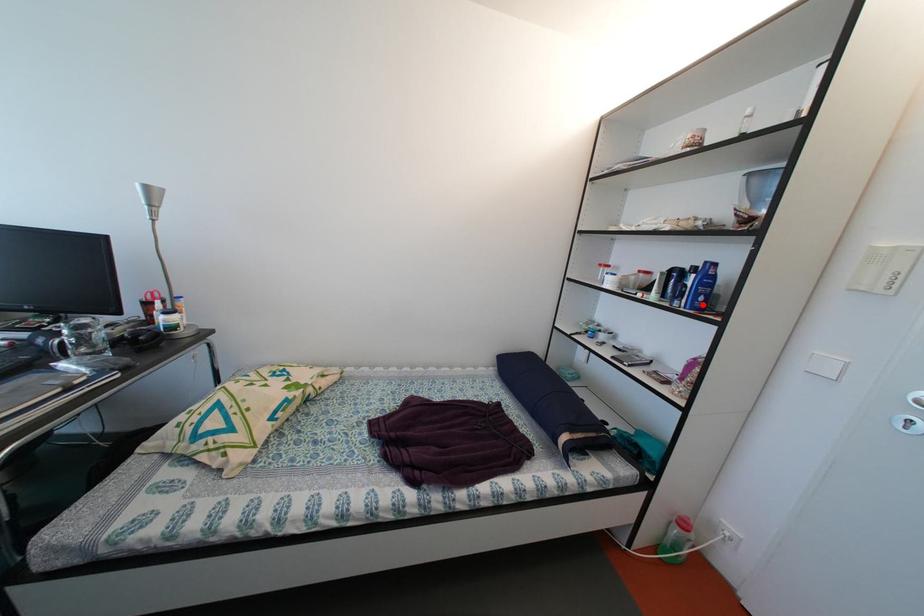
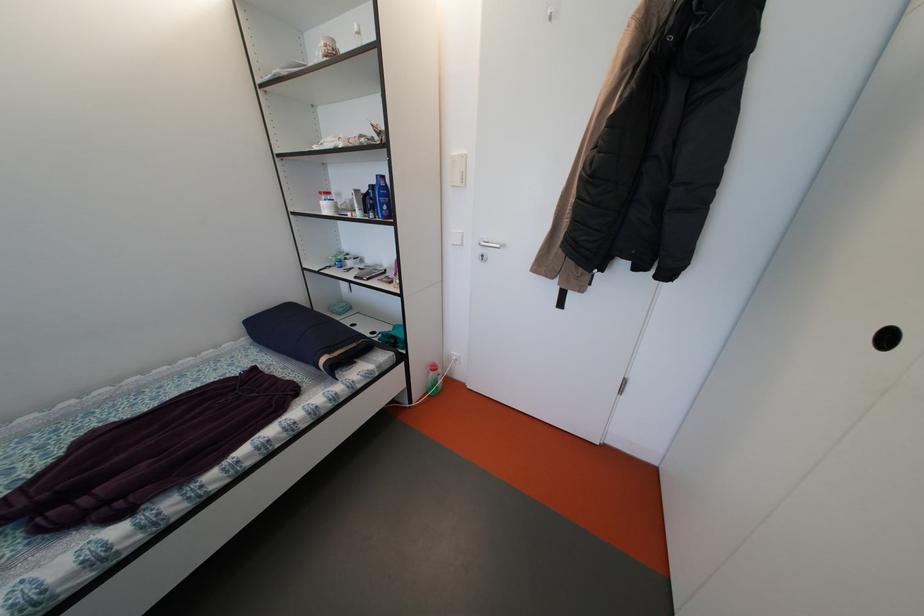
In the second image, find the point that corresponds to the highlighted location in the first image.

(390, 215)